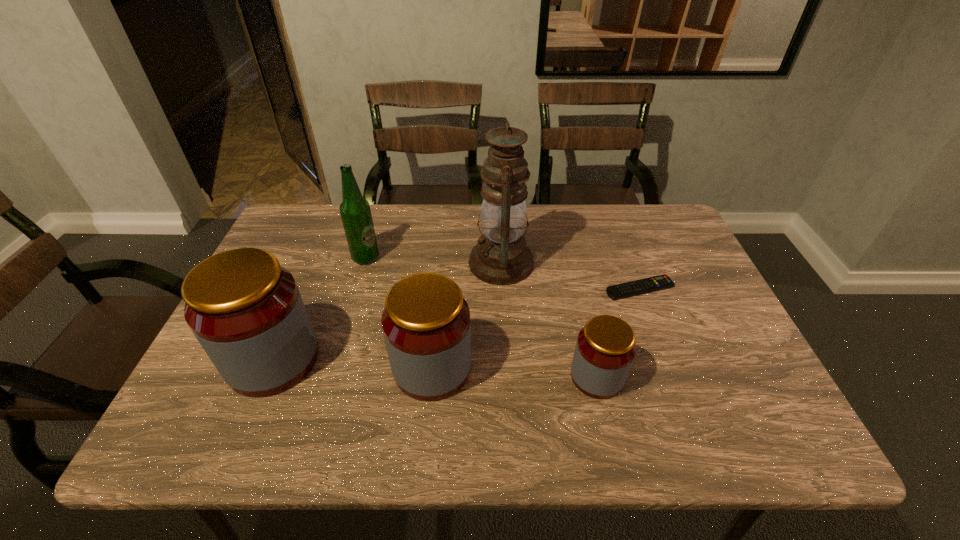
Locate an element on the screen. free space between the rightmost object and the tallest object is located at coordinates (570, 275).

Locate an element on the screen. Image resolution: width=960 pixels, height=540 pixels. free space between the beer bottle and the leftmost object is located at coordinates (320, 308).

Locate an element on the screen. Image resolution: width=960 pixels, height=540 pixels. the third closest object relative to the second jar from left to right is located at coordinates (605, 349).

Where is `object that is the fourth closest to the rightmost object`? object that is the fourth closest to the rightmost object is located at coordinates (355, 211).

The width and height of the screenshot is (960, 540). Identify the location of the closest jar to the fifth tallest object. (426, 325).

Identify which jar is the nearest to the beer bottle. Please provide its 2D coordinates. Your answer should be formatted as a tuple, i.e. [(x, y)], where the tuple contains the x and y coordinates of a point satisfying the conditions above.

[(246, 311)]

You are a GUI agent. You are given a task and a screenshot of the screen. Output one action in this format:
    pyautogui.click(x=<x>, y=<y>)
    Task: Click on the vacant region that satisfies the following two spatial constraints: 1. on the label of the fifth object from right to left; 2. on the left side of the remote control
    
    Given the screenshot: What is the action you would take?
    pyautogui.click(x=357, y=288)

Where is `vacant space that satisfies the following two spatial constraints: 1. on the back side of the shortest object; 2. on the right side of the shortest jar`? vacant space that satisfies the following two spatial constraints: 1. on the back side of the shortest object; 2. on the right side of the shortest jar is located at coordinates (577, 288).

The height and width of the screenshot is (540, 960). I want to click on vacant space that satisfies the following two spatial constraints: 1. on the back side of the tallest object; 2. on the label of the fifth object from right to left, so click(x=501, y=258).

Locate an element on the screen. vacant area in the image that satisfies the following two spatial constraints: 1. on the front side of the third shortest object; 2. on the left side of the shortest jar is located at coordinates tap(431, 376).